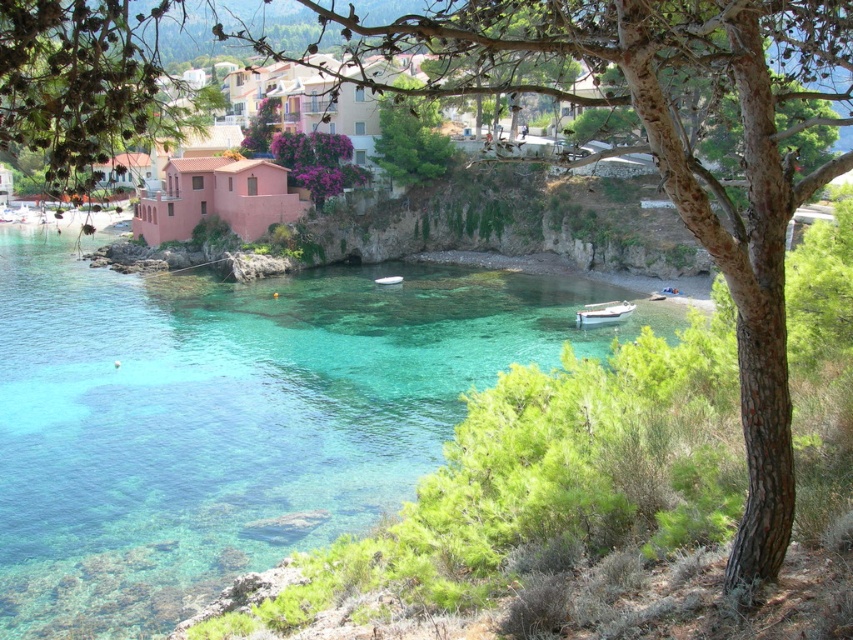
Is clear glass water at center positioned behind white matte boat at lower center?

No, clear glass water at center is in front of white matte boat at lower center.

The width and height of the screenshot is (853, 640). I want to click on clear glass water at center, so click(x=231, y=416).

Is green leafy tree at center above white matte boat at lower center?

Yes.

Does point (401, 150) lie in front of point (614, 304)?

No, (401, 150) is behind (614, 304).

Who is more distant from viewer, (x=392, y=176) or (x=619, y=310)?

Positioned behind is point (x=392, y=176).

Find the location of a particular element. The height and width of the screenshot is (640, 853). green leafy tree at center is located at coordinates (410, 140).

Is clear glass water at center to the right of green leafy tree at center from the viewer's perspective?

No, clear glass water at center is not to the right of green leafy tree at center.

Can you confirm if clear glass water at center is shorter than green leafy tree at center?

Correct, clear glass water at center is not as tall as green leafy tree at center.

This screenshot has height=640, width=853. What do you see at coordinates (231, 416) in the screenshot?
I see `clear glass water at center` at bounding box center [231, 416].

Where is `clear glass water at center`? The image size is (853, 640). clear glass water at center is located at coordinates (231, 416).